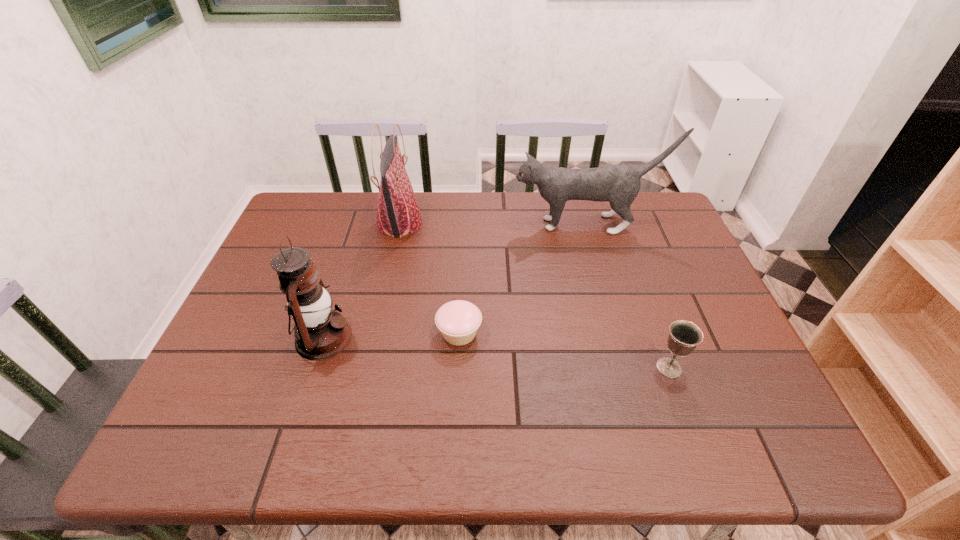
You are a GUI agent. You are given a task and a screenshot of the screen. Output one action in this format:
    pyautogui.click(x=<x>, y=<y>)
    Task: Click on the handbag
    The height and width of the screenshot is (540, 960).
    Given the screenshot: What is the action you would take?
    pyautogui.click(x=398, y=214)

I want to click on cat, so click(619, 184).

Where is `lantern`? lantern is located at coordinates (320, 333).

This screenshot has width=960, height=540. I want to click on the second shortest object, so click(x=684, y=336).

Locate an element on the screen. This screenshot has height=540, width=960. the third object from right to left is located at coordinates (458, 321).

Where is `cupcake`? This screenshot has width=960, height=540. cupcake is located at coordinates (458, 321).

The image size is (960, 540). I want to click on free space located on the right of the handbag, so click(x=506, y=224).

Image resolution: width=960 pixels, height=540 pixels. I want to click on vacant space located 0.290m at the face of the cat, so click(420, 224).

Find the location of a particular element. The width and height of the screenshot is (960, 540). vacant space situated 0.230m at the face of the cat is located at coordinates (439, 224).

The image size is (960, 540). Find the location of `free spot located 0.310m at the face of the cat`. free spot located 0.310m at the face of the cat is located at coordinates (414, 224).